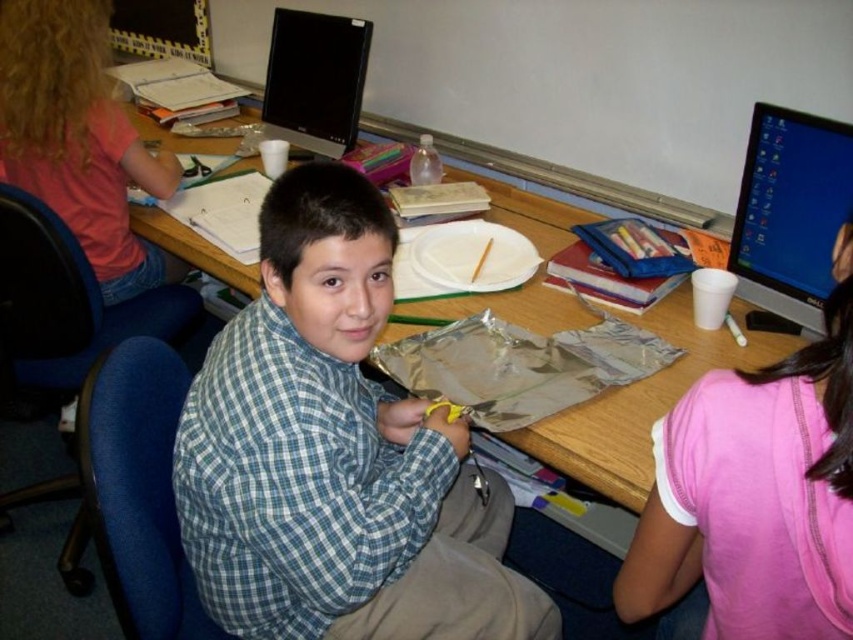
Is point (540, 637) less distant than point (595, 454)?

No, (540, 637) is behind (595, 454).

Can you confirm if blue plaid shirt at center is wider than wooden desk at center?

No, blue plaid shirt at center is not wider than wooden desk at center.

Is point (379, 493) positioned behind point (662, 304)?

That is False.

Image resolution: width=853 pixels, height=640 pixels. I want to click on blue plaid shirt at center, so click(335, 454).

Which is more to the right, pink fabric shirt at upper right or matte black monitor at upper center?

pink fabric shirt at upper right is more to the right.

Looking at this image, does pink fabric shirt at upper right have a larger size compared to matte black monitor at upper center?

Incorrect, pink fabric shirt at upper right is not larger than matte black monitor at upper center.

Where is `pink fabric shirt at upper right`? pink fabric shirt at upper right is located at coordinates (756, 493).

I want to click on pink fabric shirt at upper right, so (x=756, y=493).

Is matte black monitor at upper right wider than matte black monitor at upper center?

In fact, matte black monitor at upper right might be narrower than matte black monitor at upper center.

Is point (753, 124) farther from camera compared to point (328, 99)?

No, (753, 124) is closer to viewer.

Describe the element at coordinates (790, 211) in the screenshot. I see `matte black monitor at upper right` at that location.

Locate an element on the screen. The height and width of the screenshot is (640, 853). matte black monitor at upper right is located at coordinates pyautogui.click(x=790, y=211).